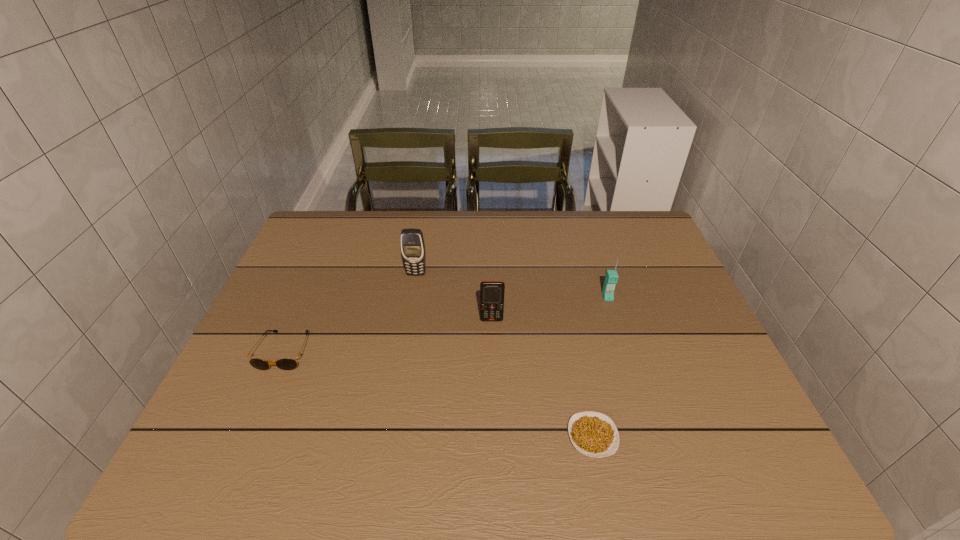
The width and height of the screenshot is (960, 540). I want to click on vacant space at the right edge of the desktop, so click(x=676, y=335).

In the image, there is a desktop. Where is `vacant space at the far right corner`? vacant space at the far right corner is located at coordinates (612, 219).

You are a GUI agent. You are given a task and a screenshot of the screen. Output one action in this format:
    pyautogui.click(x=<x>, y=<y>)
    Task: Click on the vacant space that's between the rightmost cellular telephone and the legume
    This screenshot has width=960, height=540.
    Given the screenshot: What is the action you would take?
    pyautogui.click(x=600, y=367)

You are a GUI agent. You are given a task and a screenshot of the screen. Output one action in this format:
    pyautogui.click(x=<x>, y=<y>)
    Task: Click on the blank region between the second nearest object and the shortest object
    
    Given the screenshot: What is the action you would take?
    (x=439, y=394)

The height and width of the screenshot is (540, 960). Find the location of `vacant point located between the second nearest cellular telephone and the nearest object`. vacant point located between the second nearest cellular telephone and the nearest object is located at coordinates (600, 367).

Locate an element on the screen. The width and height of the screenshot is (960, 540). free space between the third object from left to right and the rightmost cellular telephone is located at coordinates (549, 308).

Locate an element on the screen. This screenshot has width=960, height=540. vacant area that lies between the shortest object and the rightmost object is located at coordinates (600, 367).

The height and width of the screenshot is (540, 960). I want to click on unoccupied area between the third object from right to left and the rightmost object, so click(549, 308).

I want to click on vacant space that's between the nearest object and the rightmost object, so click(600, 367).

You are a GUI agent. You are given a task and a screenshot of the screen. Output one action in this format:
    pyautogui.click(x=<x>, y=<y>)
    Task: Click on the free point between the shortest object and the farthest cellular telephone
    
    Given the screenshot: What is the action you would take?
    pyautogui.click(x=504, y=355)